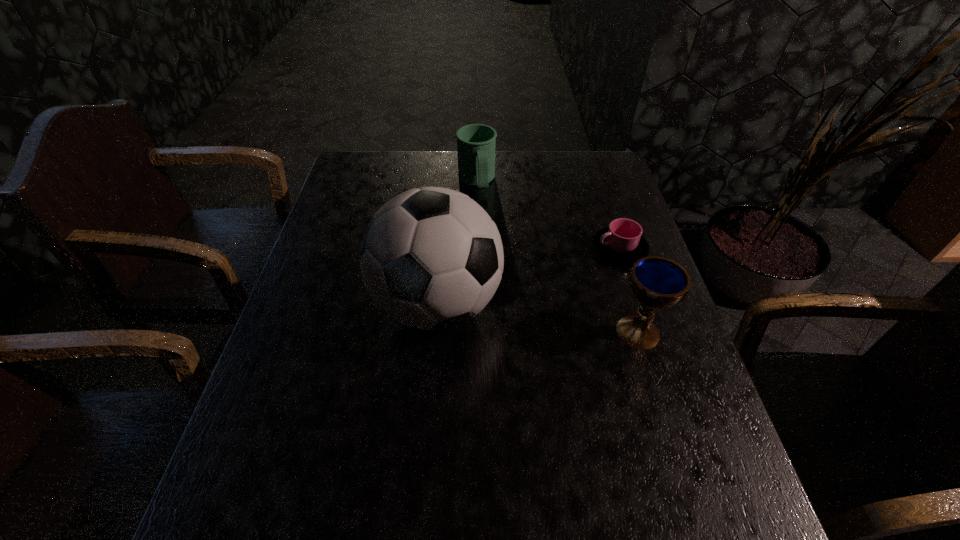
This screenshot has width=960, height=540. Find the location of `vacant space on the desktop that is between the soccer ball and the chalice and is positioned on the side of the farthest object with the handle`. vacant space on the desktop that is between the soccer ball and the chalice and is positioned on the side of the farthest object with the handle is located at coordinates (519, 316).

Where is `vacant space on the desktop that is between the soccer ball and the third shortest object and is positioned on the side with the handle of the cup`? vacant space on the desktop that is between the soccer ball and the third shortest object and is positioned on the side with the handle of the cup is located at coordinates (509, 314).